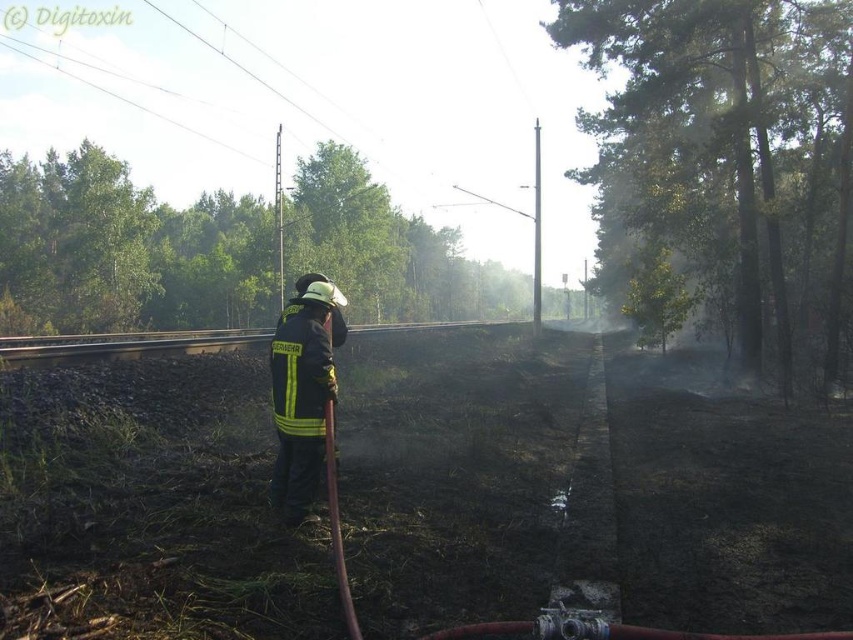
Question: Which of the following is the farthest from the observer?

Choices:
 (A) (289, 380)
 (B) (341, 602)

Answer: (A)

Question: Which of the following is the closest to the observer?

Choices:
 (A) (345, 621)
 (B) (329, 358)

Answer: (A)

Question: Is black/yellow reflective uniform at center smaller than rubber/matte fire hose at center-left?

Choices:
 (A) yes
 (B) no

Answer: (A)

Question: Considering the relative positions of black/yellow reflective uniform at center and rubber/matte fire hose at center-left in the image provided, where is black/yellow reflective uniform at center located with respect to rubber/matte fire hose at center-left?

Choices:
 (A) above
 (B) below

Answer: (A)

Question: Is black/yellow reflective uniform at center bigger than rubber/matte fire hose at center-left?

Choices:
 (A) yes
 (B) no

Answer: (B)